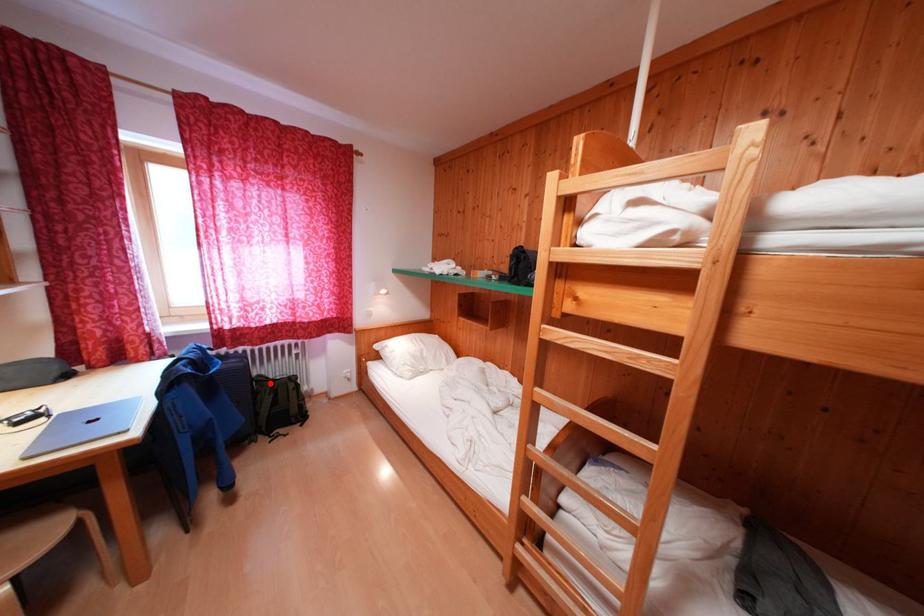
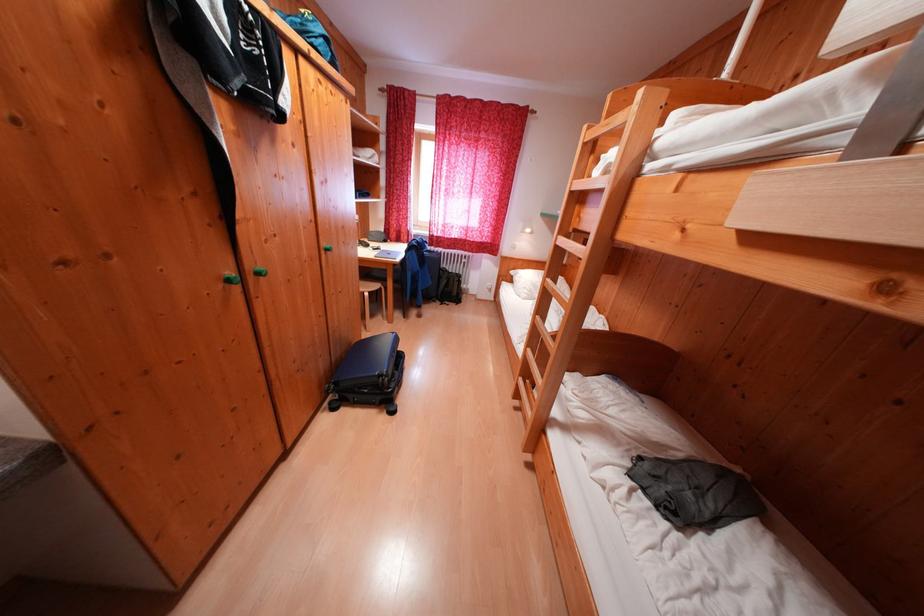
Question: I am providing you with two images of the same scene from different viewpoints. Given a red point in image1, look at the same physical point in image2. Is it:

Choices:
 (A) Closer to the viewpoint
 (B) Farther from the viewpoint

Answer: (A)